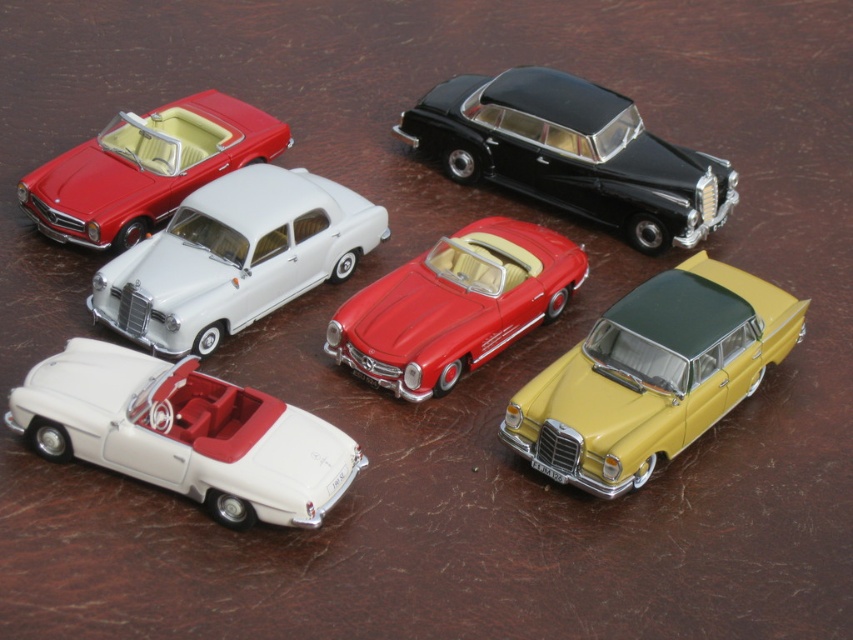
You are a toy collector who wants to display the white matte car at upper center and the black metallic sedan at upper right on a shelf. Which car will require a taller shelf space?

The white matte car at upper center requires a taller shelf space since it is much taller than the black metallic sedan at upper right.